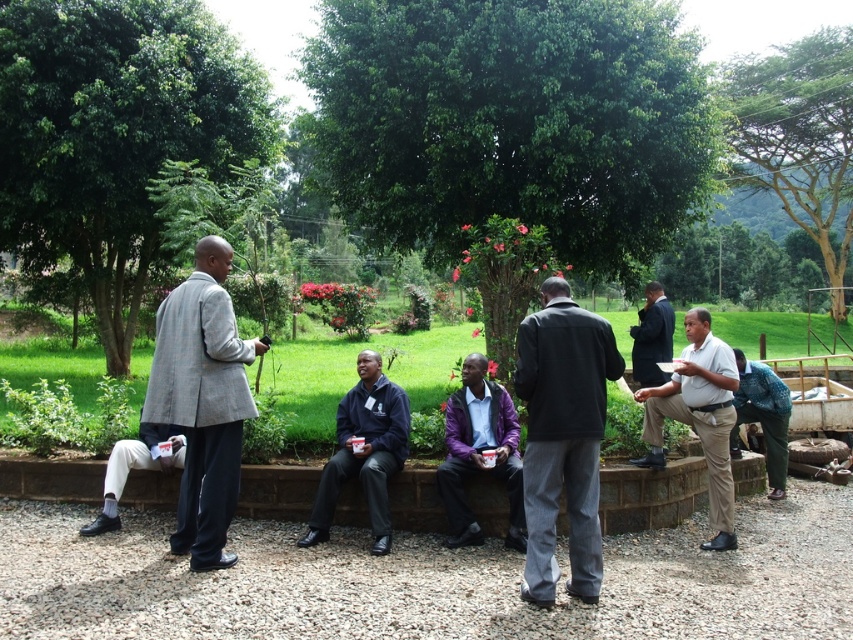
Question: Which of the following is the closest to the observer?

Choices:
 (A) dark blue suit at center
 (B) dark blue fabric jacket at center
 (C) green leafy tree at center

Answer: (B)

Question: Which point is farther to the camera?

Choices:
 (A) (459, 449)
 (B) (711, 515)
 (C) (198, 401)
 (D) (778, 476)

Answer: (D)

Question: Is gray checkered blazer at center below dark blue suit at center?

Choices:
 (A) no
 (B) yes

Answer: (B)

Question: Which is nearer to the green leafy tree at upper left?

Choices:
 (A) gray checkered blazer at center
 (B) white cotton shirt at right
 (C) purple matte jacket at center
 (D) green leafy tree at upper right

Answer: (A)

Question: Can you confirm if dark gray jacket at center is wider than white cotton shirt at right?

Choices:
 (A) yes
 (B) no

Answer: (A)

Question: Considering the relative positions of white cotton shirt at right and dark blue fabric jacket at center in the image provided, where is white cotton shirt at right located with respect to dark blue fabric jacket at center?

Choices:
 (A) left
 (B) right

Answer: (B)